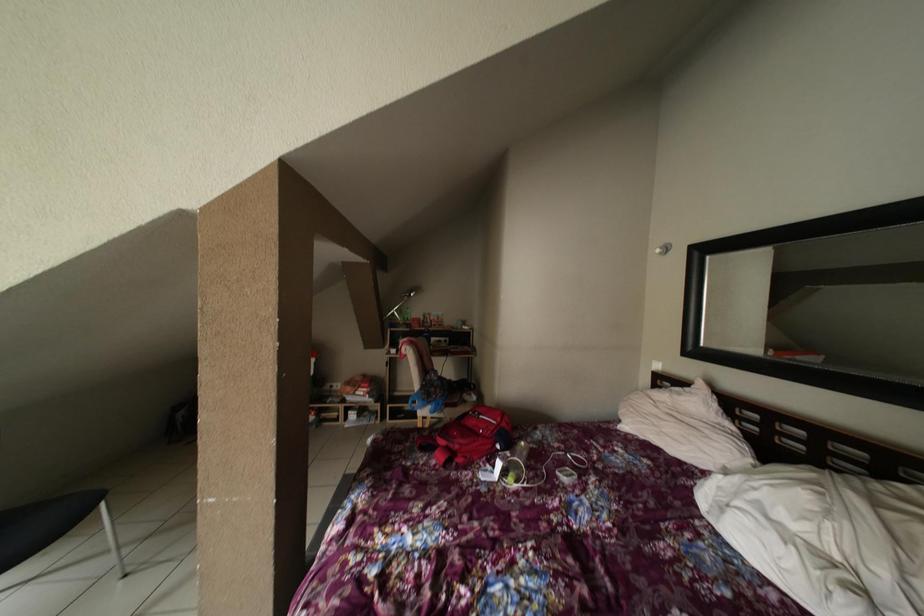
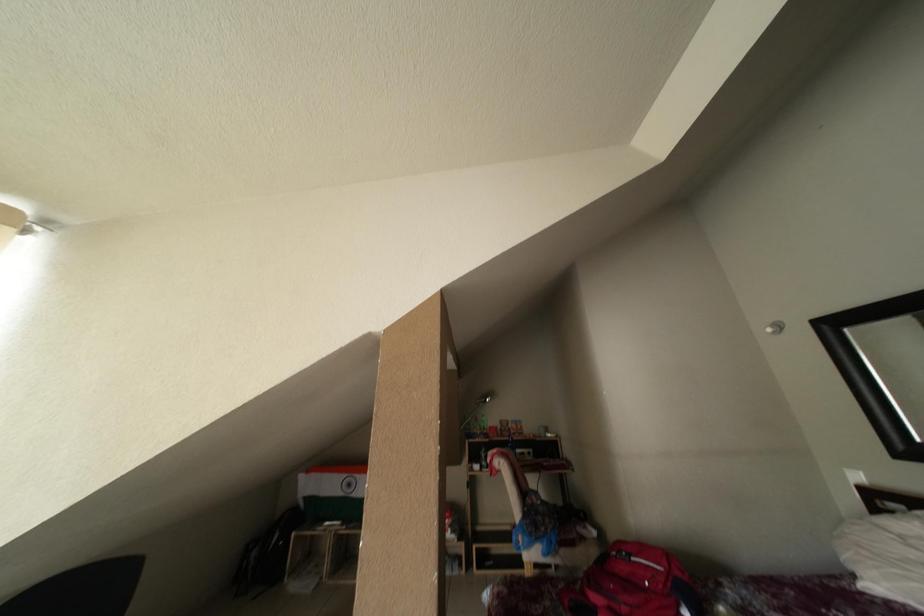
Question: What movement of the cameraman would produce the second image?

Choices:
 (A) Left
 (B) Right
 (C) Forward
 (D) Backward

Answer: (A)